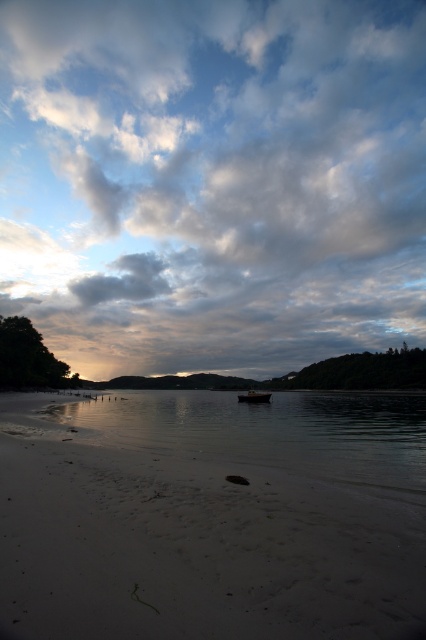
Question: Is sandy beach at lower left in front of wooden boat at center?

Choices:
 (A) yes
 (B) no

Answer: (A)

Question: Among these points, which one is nearest to the camera?

Choices:
 (A) (184, 416)
 (B) (77, 554)
 (C) (270, 72)

Answer: (B)

Question: Is cloudy sky at upper center below wooden boat at center?

Choices:
 (A) yes
 (B) no

Answer: (B)

Question: Which object appears closest to the camera in this image?

Choices:
 (A) clear water at lower center
 (B) sandy beach at lower left
 (C) wooden boat at center

Answer: (B)

Question: Considering the real-world distances, which object is closest to the sandy beach at lower left?

Choices:
 (A) wooden boat at center
 (B) cloudy sky at upper center

Answer: (A)

Question: Does cloudy sky at upper center appear over sandy beach at lower left?

Choices:
 (A) no
 (B) yes

Answer: (B)